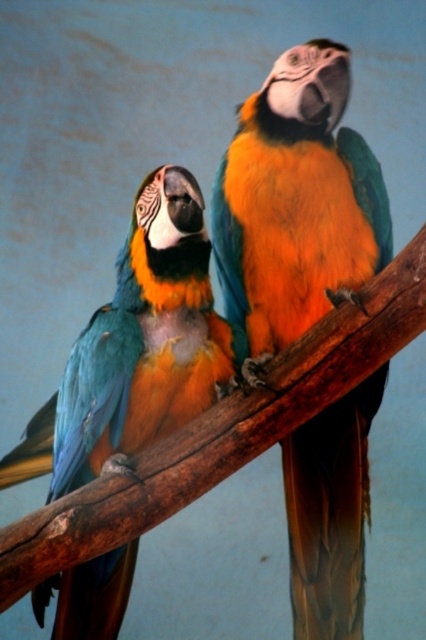
You are a birdwatcher observing two parrots in a cage. You see the shiny orange parrot at center and the shiny blue parrot at left. Which parrot is positioned more to the left?

The shiny blue parrot at left is positioned more to the left than the shiny orange parrot at center.

You are observing two parrots in the image. The shiny orange parrot at center and the shiny blue parrot at left. Which parrot is positioned higher in the image?

The shiny orange parrot at center is positioned higher than the shiny blue parrot at left.

You are a birdwatcher observing the two parrots in the image. Which parrot is closer to you, the shiny orange parrot at center or the shiny blue parrot at left?

The shiny orange parrot at center is closer to you because the shiny blue parrot at left is behind it.